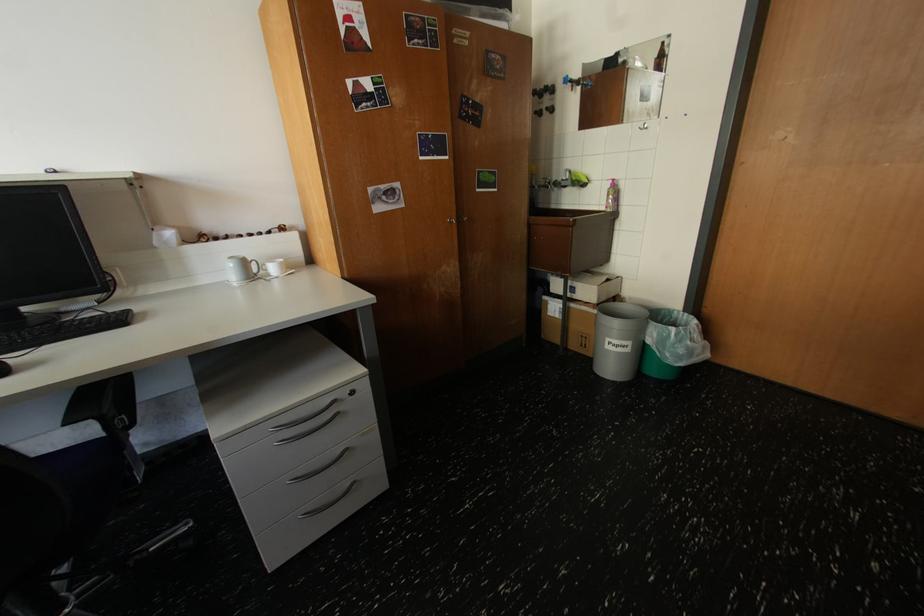
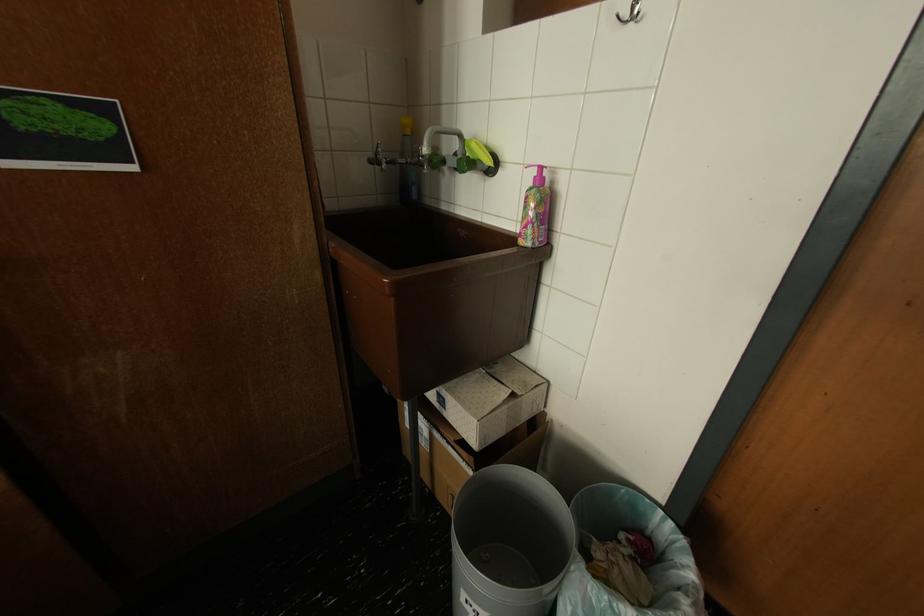
Where in the second image is the point corresponding to point (614, 208) from the first image?

(529, 235)